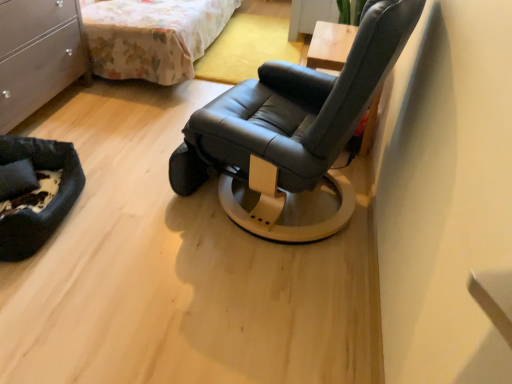
The image size is (512, 384). Describe the element at coordinates (17, 179) in the screenshot. I see `black fabric pillow at lower left` at that location.

What do you see at coordinates (37, 55) in the screenshot? The height and width of the screenshot is (384, 512). I see `matte white dresser at left` at bounding box center [37, 55].

Locate an element on the screen. black leather chair at center is located at coordinates (291, 128).

Image resolution: width=512 pixels, height=384 pixels. Describe the element at coordinates (152, 36) in the screenshot. I see `floral fabric bed at upper left` at that location.

What is the approximate height of black fabric pet bed at lower left?

8.05 inches.

I want to click on black fabric pillow at lower left, so tap(17, 179).

Considering the relative sizes of black leather chair at center and black fabric pet bed at lower left in the image provided, is black leather chair at center taller than black fabric pet bed at lower left?

Correct, black leather chair at center is much taller as black fabric pet bed at lower left.

Considering the relative sizes of black leather chair at center and black fabric pet bed at lower left in the image provided, is black leather chair at center bigger than black fabric pet bed at lower left?

Yes, black leather chair at center is bigger than black fabric pet bed at lower left.

Which is less distant, [302,187] or [60,202]?

Clearly, point [302,187] is closer to the camera than point [60,202].

Considering the relative sizes of floral fabric bed at upper left and black fabric pillow at lower left in the image provided, is floral fabric bed at upper left taller than black fabric pillow at lower left?

Yes.

Considering the sizes of objects floral fabric bed at upper left and black fabric pillow at lower left in the image provided, who is bigger, floral fabric bed at upper left or black fabric pillow at lower left?

floral fabric bed at upper left.

Is floral fabric bed at upper left oriented towards black fabric pillow at lower left?

No, floral fabric bed at upper left is not facing towards black fabric pillow at lower left.

Which is more to the left, floral fabric bed at upper left or black fabric pillow at lower left?

From the viewer's perspective, black fabric pillow at lower left appears more on the left side.

Image resolution: width=512 pixels, height=384 pixels. Find the location of `pillow that is below the matte white dresser at left (from the image's perspective)`. pillow that is below the matte white dresser at left (from the image's perspective) is located at coordinates (17, 179).

From a real-world perspective, is matte white dresser at left located higher than black fabric pillow at lower left?

Yes, from a real-world perspective, matte white dresser at left is over black fabric pillow at lower left

Is matte white dresser at left directly adjacent to black fabric pillow at lower left?

They are not placed beside each other.

Can you tell me how much matte white dresser at left and black fabric pillow at lower left differ in facing direction?

They differ by 38.7 degrees in their facing directions.

Can you tell me how much floral fabric bed at upper left and matte white dresser at left differ in facing direction?

The angular difference between floral fabric bed at upper left and matte white dresser at left is 1.03 degrees.

Image resolution: width=512 pixels, height=384 pixels. Find the location of `bed above the matte white dresser at left (from the image's perspective)`. bed above the matte white dresser at left (from the image's perspective) is located at coordinates (152, 36).

Considering the positions of objects floral fabric bed at upper left and matte white dresser at left in the image provided, who is more to the right, floral fabric bed at upper left or matte white dresser at left?

From the viewer's perspective, floral fabric bed at upper left appears more on the right side.

From a real-world perspective, is floral fabric bed at upper left physically above matte white dresser at left?

Actually, floral fabric bed at upper left is physically below matte white dresser at left in the real world.

Based on the photo, are matte white dresser at left and black fabric pet bed at lower left located far from each other?

No, there isn't a large distance between matte white dresser at left and black fabric pet bed at lower left.

Considering the relative sizes of matte white dresser at left and black fabric pet bed at lower left in the image provided, is matte white dresser at left taller than black fabric pet bed at lower left?

Yes, matte white dresser at left is taller than black fabric pet bed at lower left.

From the picture: Does matte white dresser at left have a lesser width compared to black fabric pet bed at lower left?

No.

Is matte white dresser at left facing towards black fabric pet bed at lower left?

No.

Is floral fabric bed at upper left facing away from black fabric pet bed at lower left?

No, floral fabric bed at upper left's orientation is not away from black fabric pet bed at lower left.

From the picture: Do you think floral fabric bed at upper left is within black fabric pet bed at lower left, or outside of it?

The correct answer is: outside.

Which is in front, floral fabric bed at upper left or black fabric pet bed at lower left?

black fabric pet bed at lower left is more forward.

Are floral fabric bed at upper left and black fabric pet bed at lower left making contact?

floral fabric bed at upper left and black fabric pet bed at lower left are not in contact.

Which of these two, black fabric pet bed at lower left or matte white dresser at left, is thinner?

With smaller width is black fabric pet bed at lower left.

From a real-world perspective, which is physically above, black fabric pet bed at lower left or matte white dresser at left?

matte white dresser at left.

Would you say black fabric pet bed at lower left is outside matte white dresser at left?

Yes, black fabric pet bed at lower left is outside of matte white dresser at left.

Consider the image. Is black fabric pet bed at lower left oriented away from matte white dresser at left?

That's not correct — black fabric pet bed at lower left is not looking away from matte white dresser at left.

This screenshot has height=384, width=512. Find the location of `chair that is in front of the black fabric pet bed at lower left`. chair that is in front of the black fabric pet bed at lower left is located at coordinates (291, 128).

At what (x,y) coordinates should I click in order to perform the action: click on bed above the black fabric pillow at lower left (from the image's perspective). Please return your answer as a coordinate pair (x, y). Looking at the image, I should click on (152, 36).

Considering their positions, is floral fabric bed at upper left positioned closer to black fabric pet bed at lower left than black fabric pillow at lower left?

black fabric pillow at lower left is closer to black fabric pet bed at lower left.

Estimate the real-world distances between objects in this image. Which object is closer to matte white dresser at left, black fabric pillow at lower left or floral fabric bed at upper left?

floral fabric bed at upper left.

When comparing their distances from black leather chair at center, does black fabric pillow at lower left or black fabric pet bed at lower left seem further?

The object further to black leather chair at center is black fabric pillow at lower left.

Based on their spatial positions, is black fabric pillow at lower left or black leather chair at center closer to black fabric pet bed at lower left?

black fabric pillow at lower left is closer to black fabric pet bed at lower left.

From the image, which object appears to be nearer to black fabric pillow at lower left, matte white dresser at left or black fabric pet bed at lower left?

black fabric pet bed at lower left is closer to black fabric pillow at lower left.

Estimate the real-world distances between objects in this image. Which object is closer to black leather chair at center, floral fabric bed at upper left or matte white dresser at left?

matte white dresser at left.

Based on their spatial positions, is matte white dresser at left or black fabric pillow at lower left closer to floral fabric bed at upper left?

Among the two, matte white dresser at left is located nearer to floral fabric bed at upper left.

Looking at the image, which one is located closer to black leather chair at center, black fabric pet bed at lower left or floral fabric bed at upper left?

black fabric pet bed at lower left lies closer to black leather chair at center than the other object.

Where is `chest of drawers between floral fabric bed at upper left and black fabric pillow at lower left in the vertical direction`? The width and height of the screenshot is (512, 384). chest of drawers between floral fabric bed at upper left and black fabric pillow at lower left in the vertical direction is located at coordinates (37, 55).

Where is `pillow between matte white dresser at left and black leather chair at center in the horizontal direction`? This screenshot has height=384, width=512. pillow between matte white dresser at left and black leather chair at center in the horizontal direction is located at coordinates (17, 179).

This screenshot has height=384, width=512. I want to click on chair between floral fabric bed at upper left and black fabric pillow at lower left in the up-down direction, so click(291, 128).

The image size is (512, 384). I want to click on pillow between matte white dresser at left and black fabric pet bed at lower left vertically, so click(x=17, y=179).